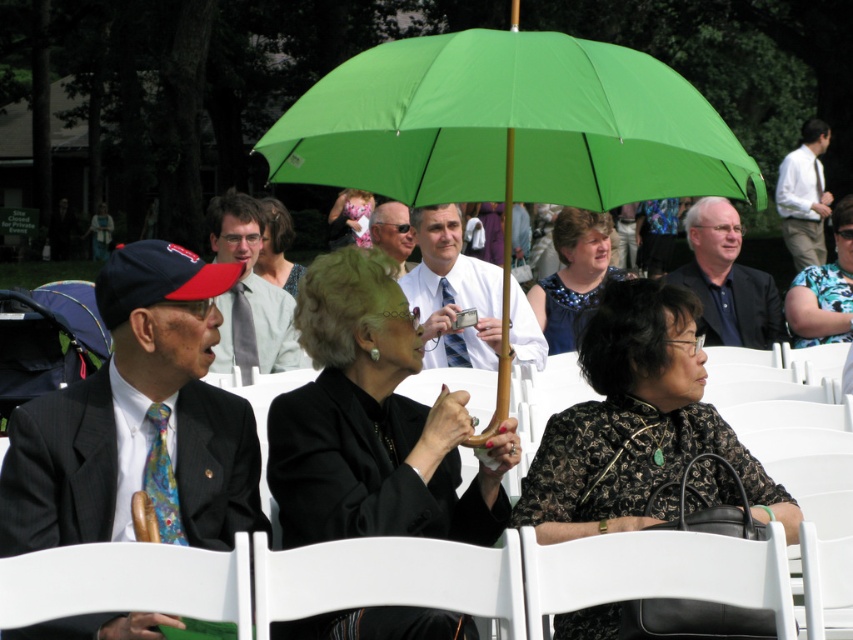
You are attending an outdoor event and need to sit down. There is a white plastic chair at lower center and a matte gray sweater at center. Which object should you sit on?

You should sit on the white plastic chair at lower center because it is designed for sitting, while the matte gray sweater at center is an item of clothing and not meant for sitting.

You are planning to place a matte gray sweater at center on the white plastic chair at lower center. Based on the spatial relationship between them, will the sweater fit comfortably on the chair?

The white plastic chair at lower center might be wider than matte gray sweater at center, so the sweater could fit comfortably on the chair if the chair is indeed wider. However, the exact fit depends on the chair width and sweater dimensions.